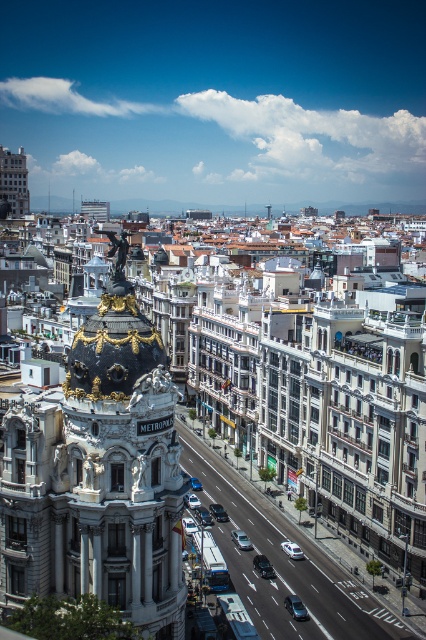
Between point (5, 184) and point (291, 545), which one is positioned in front?

Point (291, 545) is in front.

Between matte gray building at upper left and white glossy car at center, which one has less height?

white glossy car at center is shorter.

Where is `matte gray building at upper left`? matte gray building at upper left is located at coordinates (13, 182).

Image resolution: width=426 pixels, height=640 pixels. I want to click on matte gray building at upper left, so click(13, 182).

Does point (120, 264) come in front of point (250, 547)?

Yes, it is.

Can you confirm if gold/gilded statue at upper center is smaller than silver metallic car at center?

Incorrect, gold/gilded statue at upper center is not smaller in size than silver metallic car at center.

Between point (120, 276) and point (245, 548), which one is positioned behind?

The point (245, 548) is more distant.

Locate an element on the screen. This screenshot has width=426, height=640. gold/gilded statue at upper center is located at coordinates (117, 250).

Can you confirm if silver/golden ornate dome at center-left is taller than silver metallic car at center?

Correct, silver/golden ornate dome at center-left is much taller as silver metallic car at center.

Between point (25, 433) and point (235, 531), which one is positioned behind?

Positioned behind is point (235, 531).

The image size is (426, 640). I want to click on silver/golden ornate dome at center-left, so click(x=98, y=476).